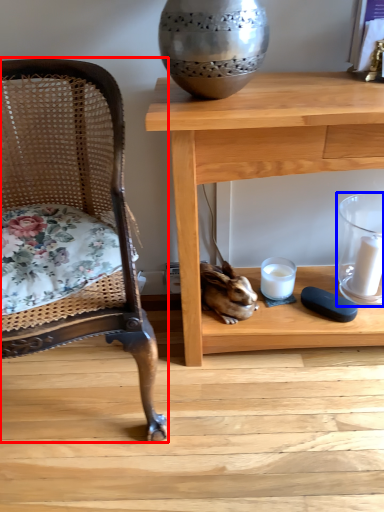
Question: Among these objects, which one is nearest to the camera, chair (highlighted by a red box) or candle holder (highlighted by a blue box)?

Choices:
 (A) chair
 (B) candle holder

Answer: (A)